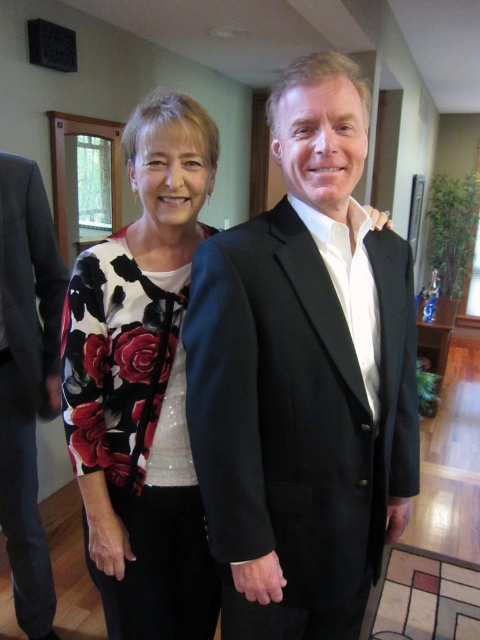
Does point (111, 276) lie in front of point (14, 548)?

Yes, it is in front of point (14, 548).

Does point (139, 362) come behind point (44, 374)?

No, (139, 362) is in front of (44, 374).

Identify the location of floral-patterned blouse at center. tap(142, 385).

Is black smooth suit at center further to camera compared to floral-patterned blouse at center?

No, it is not.

Identify the location of black smooth suit at center. 303,378.

Locate an element on the screen. This screenshot has height=640, width=480. black smooth suit at center is located at coordinates (303, 378).

Is black smooth suit at center below dark gray wool suit at left?

Actually, black smooth suit at center is above dark gray wool suit at left.

Looking at this image, is black smooth suit at center to the right of dark gray wool suit at left from the viewer's perspective?

Indeed, black smooth suit at center is positioned on the right side of dark gray wool suit at left.

Measure the distance between point (261, 360) and camera.

Point (261, 360) and camera are 36.17 inches apart from each other.

This screenshot has height=640, width=480. Find the location of `black smooth suit at center`. black smooth suit at center is located at coordinates (303, 378).